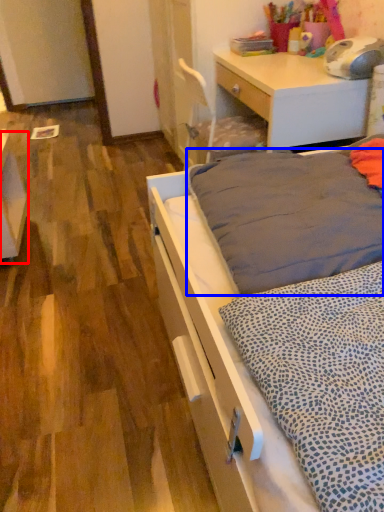
Question: Among these objects, which one is farthest to the camera, vanity (highlighted by a red box) or mattress (highlighted by a blue box)?

Choices:
 (A) vanity
 (B) mattress

Answer: (A)